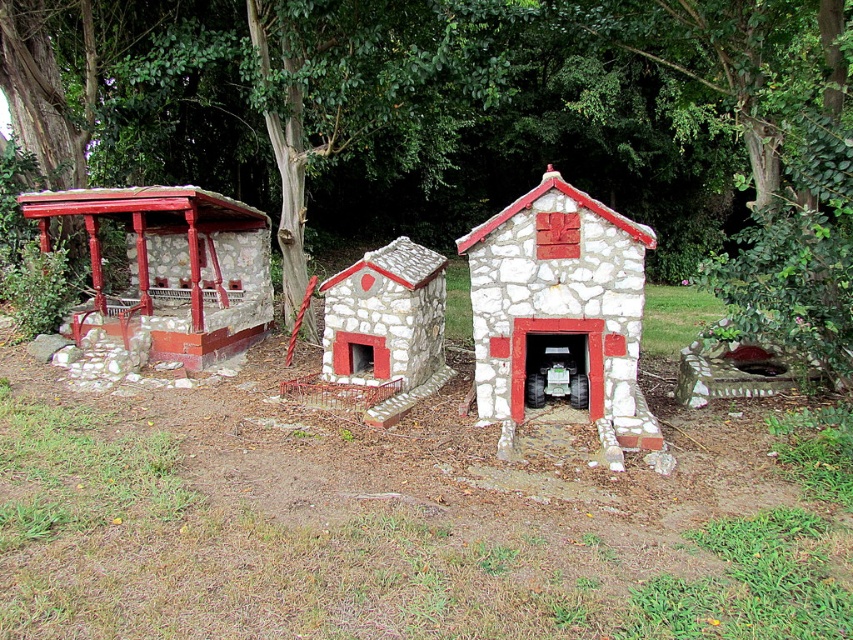
Where is `green leafy tree at upper center`? This screenshot has height=640, width=853. green leafy tree at upper center is located at coordinates (476, 124).

This screenshot has height=640, width=853. What are the coordinates of `green leafy tree at upper center` in the screenshot? It's located at (476, 124).

Where is `green leafy tree at upper center`? The image size is (853, 640). green leafy tree at upper center is located at coordinates (476, 124).

Which is more to the left, green leafy tree at upper center or brushed metal gazebo at left?

brushed metal gazebo at left is more to the left.

Who is positioned more to the right, green leafy tree at upper center or brushed metal gazebo at left?

green leafy tree at upper center

This screenshot has height=640, width=853. I want to click on green leafy tree at upper center, so click(476, 124).

Can you confirm if white stone fireplace at center is bigger than stone/redobject at center?

Yes.

Is white stone fireplace at center shorter than stone/redobject at center?

No, white stone fireplace at center is not shorter than stone/redobject at center.

Who is more distant from viewer, (509, 220) or (374, 381)?

Point (374, 381)

This screenshot has height=640, width=853. Identify the location of white stone fireplace at center. (560, 314).